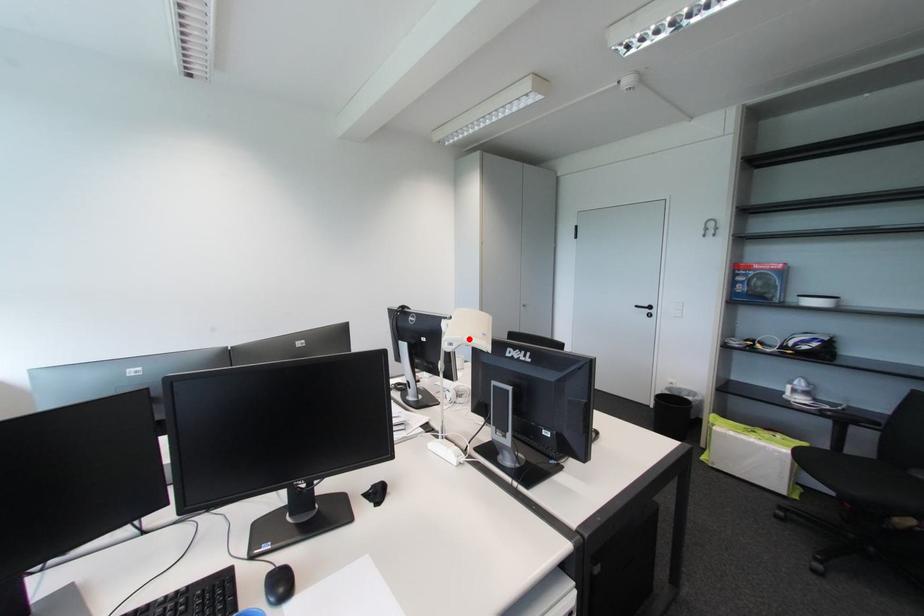
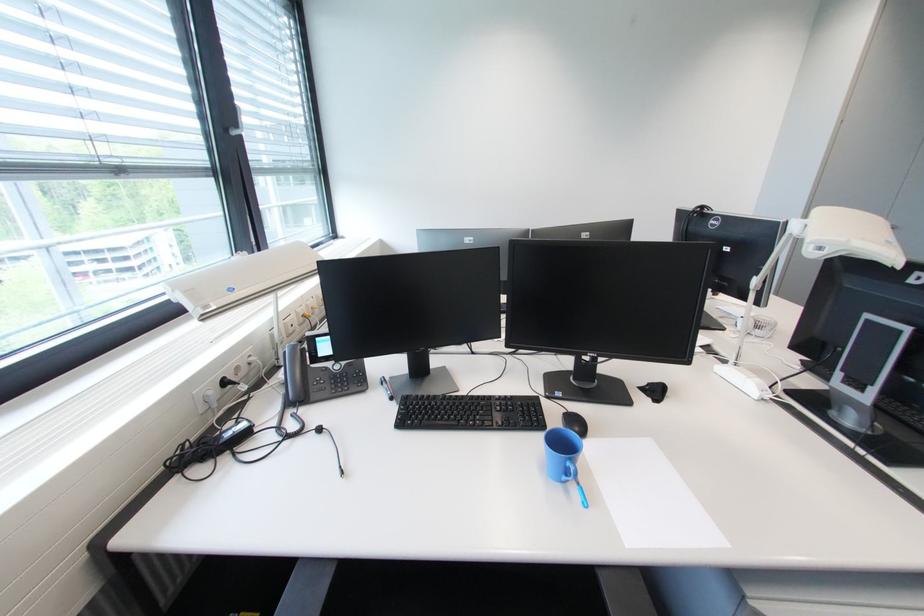
Find the pixel in the second image that matches the highlighted location in the first image.

(856, 243)